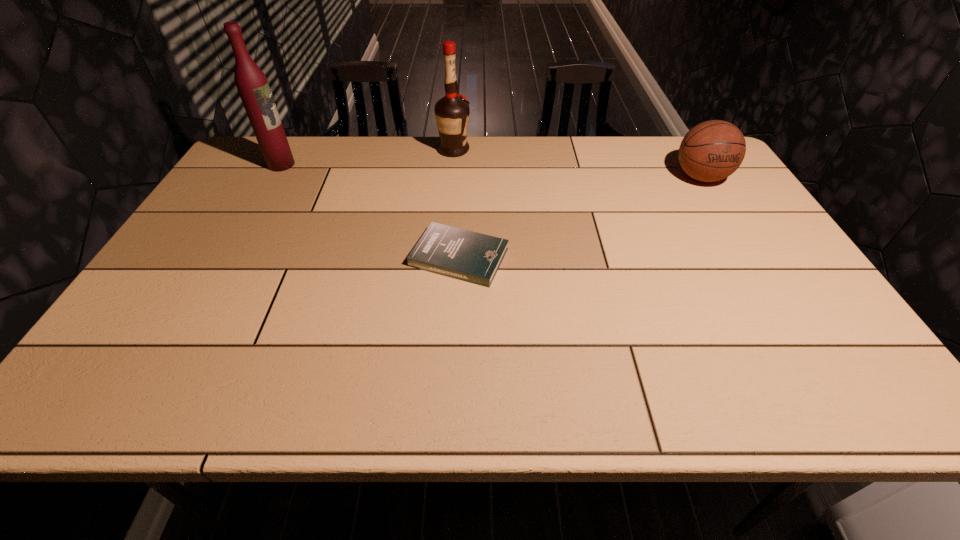
Locate an element on the screen. This screenshot has height=540, width=960. vacant space at the far left corner of the desktop is located at coordinates (253, 173).

Locate an element on the screen. This screenshot has width=960, height=540. vacant space at the near left corner of the desktop is located at coordinates (166, 376).

This screenshot has width=960, height=540. In the image, there is a desktop. What are the coordinates of `free space at the far right corner` in the screenshot? It's located at (676, 165).

The image size is (960, 540). In order to click on vacant area that lies between the book and the left liquor in this screenshot , I will do `click(371, 211)`.

The width and height of the screenshot is (960, 540). Identify the location of free space between the book and the right liquor. (457, 204).

Where is `empty space that is in between the tallest object and the rightmost object`? empty space that is in between the tallest object and the rightmost object is located at coordinates (491, 171).

This screenshot has height=540, width=960. In order to click on vacant area that lies between the shorter liquor and the third tallest object in this screenshot , I will do `click(577, 164)`.

This screenshot has height=540, width=960. Find the location of `empty space that is in between the left liquor and the basketball`. empty space that is in between the left liquor and the basketball is located at coordinates (491, 171).

The height and width of the screenshot is (540, 960). I want to click on free space between the nearest object and the second tallest object, so click(x=457, y=204).

Where is `vacant area between the taller liquor and the nearest object`? vacant area between the taller liquor and the nearest object is located at coordinates (371, 211).